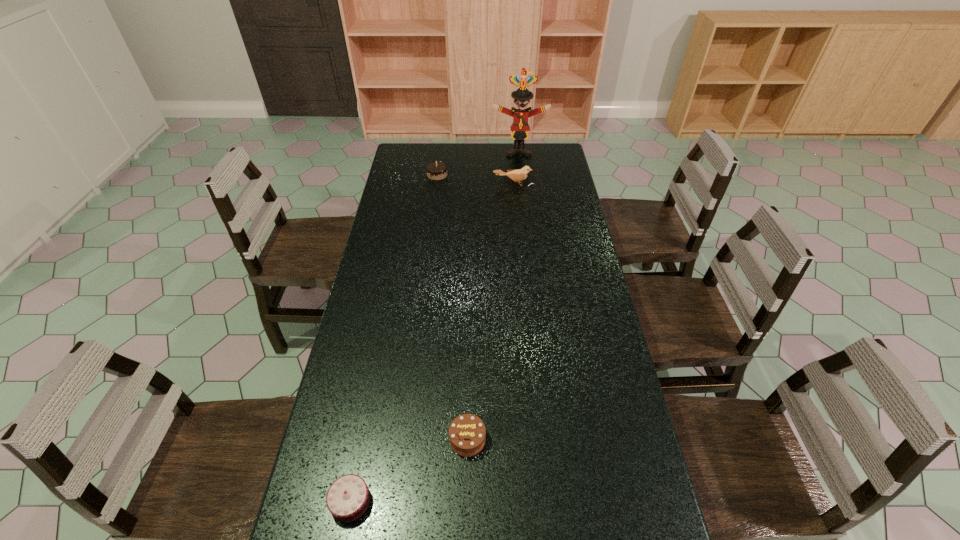
The width and height of the screenshot is (960, 540). I want to click on blank space located 0.060m on the front-facing side of the tallest object, so click(520, 163).

This screenshot has height=540, width=960. I want to click on vacant region located 0.130m at the beak of the third nearest object, so click(516, 206).

Locate an element on the screen. free space located 0.130m on the back of the farthest chocolate cake is located at coordinates (440, 155).

Identify the location of vacant space positioned 0.160m on the right of the third object from right to left. (550, 440).

Locate an element on the screen. vacant space positioned on the right of the shortest chocolate cake is located at coordinates (526, 501).

You are a GUI agent. You are given a task and a screenshot of the screen. Output one action in this format:
    pyautogui.click(x=<x>, y=<y>)
    Task: Click on the nutcracker present at the far edge
    
    Given the screenshot: What is the action you would take?
    pyautogui.click(x=520, y=127)

Where is `chocolate cake located in the far edge section of the desktop`? The height and width of the screenshot is (540, 960). chocolate cake located in the far edge section of the desktop is located at coordinates (436, 170).

The height and width of the screenshot is (540, 960). I want to click on nutcracker at the right edge, so click(520, 127).

What are the coordinates of `bird that is at the right edge` in the screenshot? It's located at (518, 175).

The width and height of the screenshot is (960, 540). Find the location of `object located at the far left corner`. object located at the far left corner is located at coordinates (436, 170).